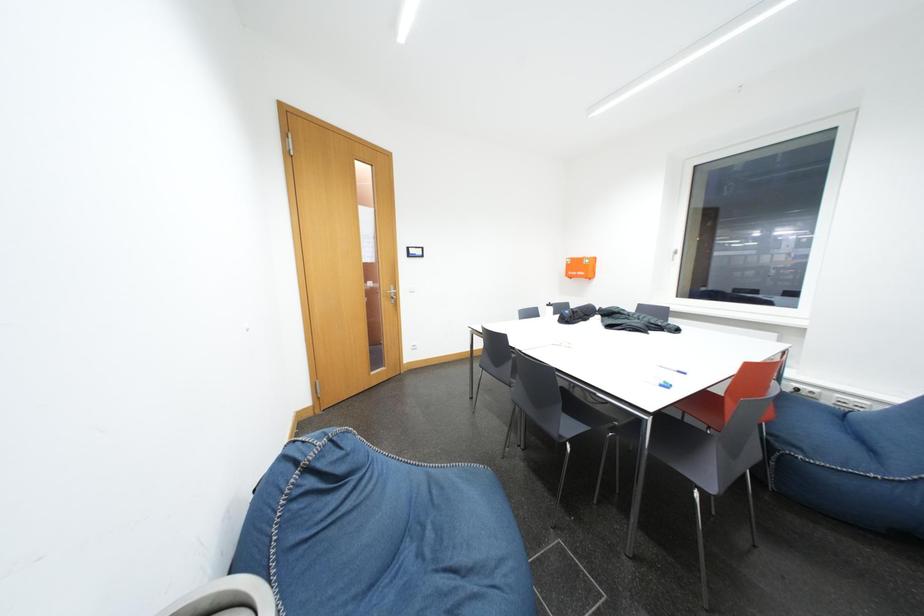
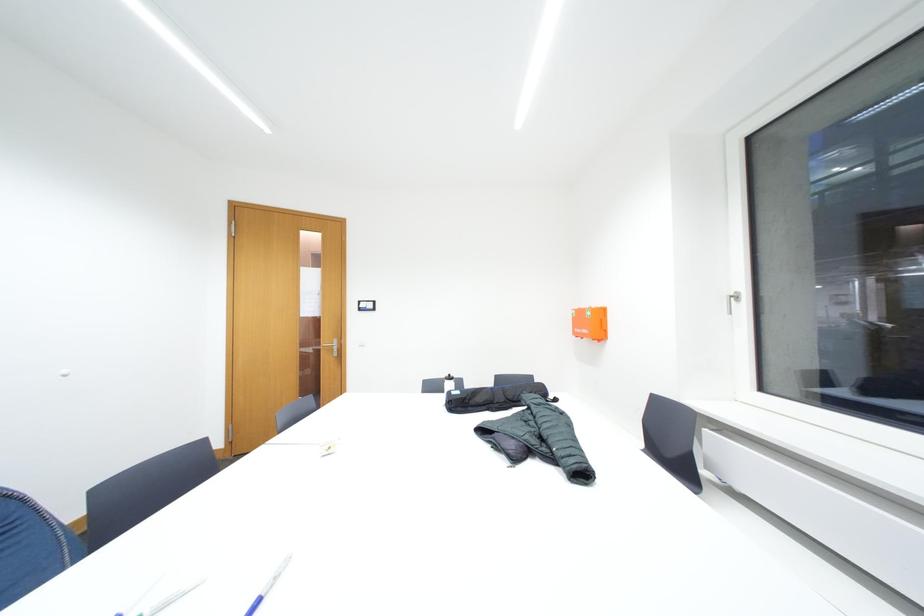
In a continuous first-person perspective shot, in which direction is the camera moving?

The cameraman walked toward right, forward.